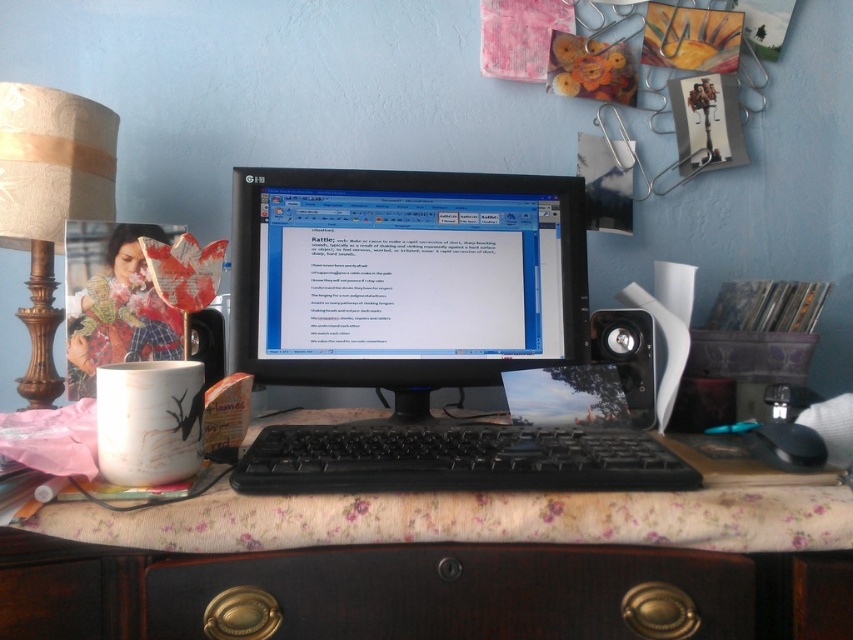
You are setting up a new desk and want to place a keyboard and a mouse in a way that they don not overlap. Given that the black plastic keyboard at center is larger than the black plastic mouse at lower right, where should you position them to ensure there is enough space between them?

Since the black plastic keyboard at center is larger than the black plastic mouse at lower right, you should place the black plastic keyboard at center in the central area of the desk and position the black plastic mouse at lower right towards the lower right corner to maintain sufficient space between them.

You are organizing your desk and want to place a new item between the black matte monitor at center and the white matte mug at center. Considering their heights, which object should you place the item closer to in order to maintain visual balance?

You should place the item closer to the white matte mug at center because the black matte monitor at center is much taller, so the shorter white matte mug at center needs more visual weight to balance the composition.

You are organizing your desk and need to place a new item between the floral fabric computer desk at center and the black plastic mouse at lower right. Based on their positions, where should you place the item?

Since the floral fabric computer desk at center is to the left of the black plastic mouse at lower right, you should place the new item between them on the desk surface, ensuring it is positioned between the two objects.